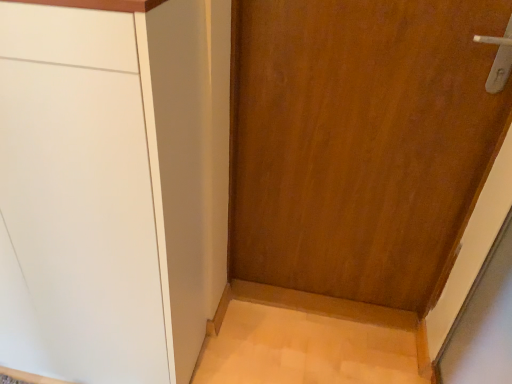
Describe the element at coordinates (359, 142) in the screenshot. I see `wooden door at center` at that location.

Locate an element on the screen. wooden door at center is located at coordinates (359, 142).

What do you see at coordinates (112, 188) in the screenshot?
I see `matte white cabinet at left` at bounding box center [112, 188].

Locate an element on the screen. matte white cabinet at left is located at coordinates (112, 188).

Identify the location of wooden door at center. (359, 142).

Is matte white cabinet at left to the left of wooden door at center from the viewer's perspective?

Yes.

Is matte white cabinet at left further to camera compared to wooden door at center?

No, matte white cabinet at left is in front of wooden door at center.

Is point (64, 187) in front of point (461, 188)?

Yes, it is in front of point (461, 188).

From the image's perspective, is matte white cabinet at left above or below wooden door at center?

Based on their image positions, matte white cabinet at left is located beneath wooden door at center.

From a real-world perspective, between matte white cabinet at left and wooden door at center, who is vertically lower?

From a 3D spatial view, wooden door at center is below.

Is matte white cabinet at left wider or thinner than wooden door at center?

Considering their sizes, matte white cabinet at left looks broader than wooden door at center.

Considering the relative sizes of matte white cabinet at left and wooden door at center in the image provided, is matte white cabinet at left shorter than wooden door at center?

No, matte white cabinet at left is not shorter than wooden door at center.

Who is bigger, matte white cabinet at left or wooden door at center?

matte white cabinet at left is bigger.

Could wooden door at center be considered to be inside matte white cabinet at left?

No, wooden door at center is located outside of matte white cabinet at left.

Is matte white cabinet at left next to wooden door at center and touching it?

There is a gap between matte white cabinet at left and wooden door at center.

Is matte white cabinet at left looking in the opposite direction of wooden door at center?

No, matte white cabinet at left is not facing away from wooden door at center.

In the scene shown: What's the angular difference between matte white cabinet at left and wooden door at center's facing directions?

They differ by 0.716 degrees in their facing directions.

Locate an element on the screen. The image size is (512, 384). cabinetry in front of the wooden door at center is located at coordinates (112, 188).

In the scene shown: Can you confirm if wooden door at center is positioned to the right of matte white cabinet at left?

Indeed, wooden door at center is positioned on the right side of matte white cabinet at left.

Which object is closer to the camera taking this photo, wooden door at center or matte white cabinet at left?

matte white cabinet at left is more forward.

Does point (356, 215) come farther from viewer compared to point (28, 12)?

Yes.

From the image's perspective, is wooden door at center located beneath matte white cabinet at left?

No, from the image's perspective, wooden door at center is not below matte white cabinet at left.

From a real-world perspective, which is physically above, wooden door at center or matte white cabinet at left?

matte white cabinet at left is physically above.

Considering the sizes of objects wooden door at center and matte white cabinet at left in the image provided, who is wider, wooden door at center or matte white cabinet at left?

matte white cabinet at left.

Considering the sizes of wooden door at center and matte white cabinet at left in the image, is wooden door at center taller or shorter than matte white cabinet at left?

Clearly, wooden door at center is shorter compared to matte white cabinet at left.

Looking at this image, does wooden door at center have a smaller size compared to matte white cabinet at left?

Indeed, wooden door at center has a smaller size compared to matte white cabinet at left.

Is wooden door at center inside or outside of matte white cabinet at left?

wooden door at center cannot be found inside matte white cabinet at left.

Is wooden door at center far away from matte white cabinet at left?

No, there isn't a large distance between wooden door at center and matte white cabinet at left.

Is wooden door at center positioned with its back to matte white cabinet at left?

That's not correct — wooden door at center is not looking away from matte white cabinet at left.

Find the location of `door behind the matte white cabinet at left`. door behind the matte white cabinet at left is located at coordinates (359, 142).

Locate an element on the screen. This screenshot has height=384, width=512. cabinetry below the wooden door at center (from the image's perspective) is located at coordinates (112, 188).

At what (x,y) coordinates should I click in order to perform the action: click on door that appears below the matte white cabinet at left (from a real-world perspective). Please return your answer as a coordinate pair (x, y). Looking at the image, I should click on (359, 142).